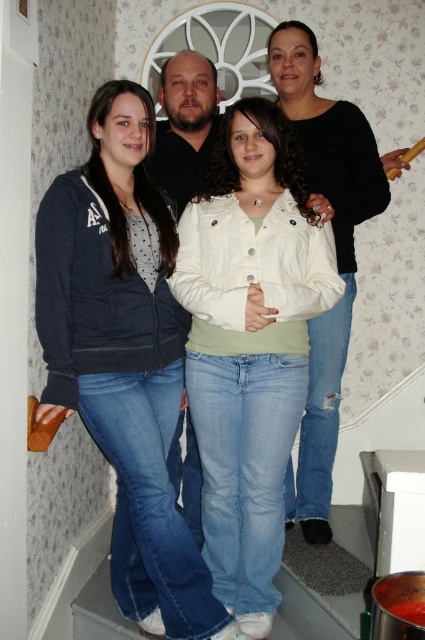
Question: Which object is positioned closest to the matte black jacket at center?

Choices:
 (A) white matte jacket at center
 (B) black matte jacket at upper center

Answer: (A)

Question: Which point is farther from the camera taking this photo?

Choices:
 (A) (65, 268)
 (B) (325, 324)

Answer: (B)

Question: Does white matte jacket at center appear on the left side of black matte jacket at upper center?

Choices:
 (A) yes
 (B) no

Answer: (A)

Question: Is matte black jacket at center above white matte jacket at center?

Choices:
 (A) no
 (B) yes

Answer: (B)

Question: Which point is closer to the camera?

Choices:
 (A) white matte jacket at center
 (B) black matte jacket at upper center

Answer: (A)

Question: Is white matte jacket at center thinner than black matte jacket at upper center?

Choices:
 (A) yes
 (B) no

Answer: (B)